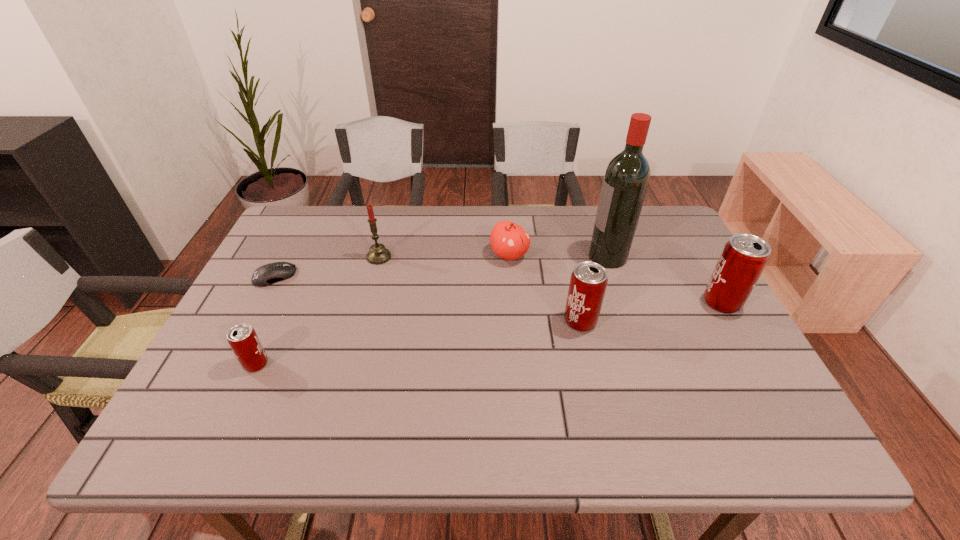
Locate an element on the screen. The image size is (960, 540). free area in between the rightmost beer can and the nearest beer can is located at coordinates (489, 333).

Find the location of a particular element. The width and height of the screenshot is (960, 540). free space between the nearest beer can and the rightmost object is located at coordinates (489, 333).

Identify the location of empty space that is in between the third object from left to right and the third object from right to left. (480, 289).

Image resolution: width=960 pixels, height=540 pixels. Find the location of `free space between the fourth object from left to right and the rightmost object`. free space between the fourth object from left to right and the rightmost object is located at coordinates (615, 279).

Select which object is the second closest to the tallest object. Please provide its 2D coordinates. Your answer should be formatted as a tuple, i.e. [(x, y)], where the tuple contains the x and y coordinates of a point satisfying the conditions above.

[(744, 257)]

Locate an element on the screen. Image resolution: width=960 pixels, height=540 pixels. the third closest object relative to the second object from right to left is located at coordinates (509, 241).

Where is `beer can that is the second nearest to the rightmost beer can`? beer can that is the second nearest to the rightmost beer can is located at coordinates (242, 338).

Locate which beer can is the third closest to the second object from right to left. Please provide its 2D coordinates. Your answer should be formatted as a tuple, i.e. [(x, y)], where the tuple contains the x and y coordinates of a point satisfying the conditions above.

[(242, 338)]